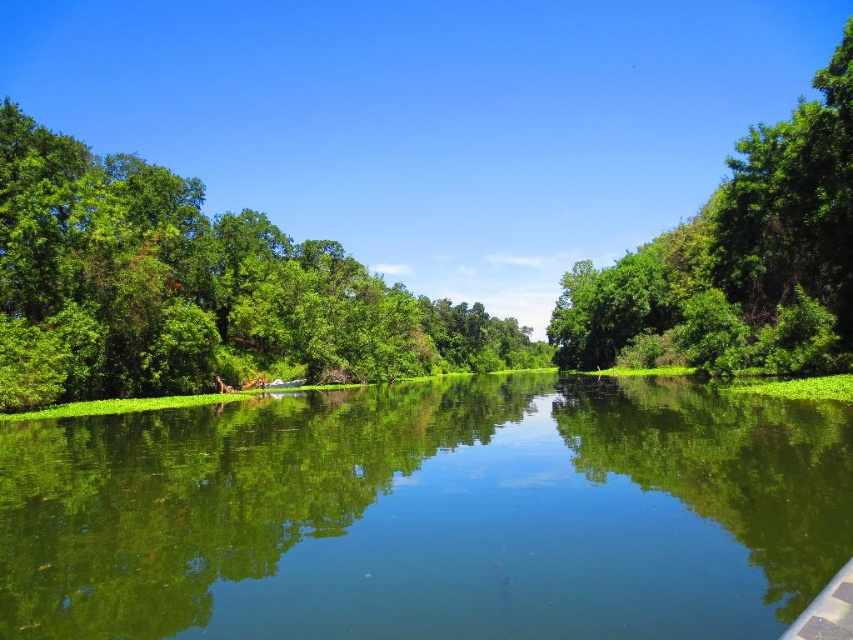
Who is higher up, green leafy tree at center or green leafy tree at right?

green leafy tree at right is higher up.

Can you confirm if green leafy tree at center is thinner than green leafy tree at right?

No.

Who is more distant from viewer, (281, 340) or (821, 268)?

Positioned behind is point (281, 340).

At what (x,y) coordinates should I click in order to perform the action: click on green leafy tree at center. Please return your answer as a coordinate pair (x, y). This screenshot has height=640, width=853. Looking at the image, I should click on click(x=195, y=291).

Does point (555, 410) come behind point (776, 179)?

No, (555, 410) is closer to viewer.

Which is behind, point (194, 580) or point (558, 344)?

Positioned behind is point (558, 344).

Where is `green reflective water at center`? This screenshot has height=640, width=853. green reflective water at center is located at coordinates (428, 515).

Which of these two, green reflective water at center or green leafy tree at center, stands taller?

With more height is green leafy tree at center.

Which is behind, point (682, 554) or point (248, 362)?

Point (248, 362)

Is point (805, 490) closer to camera compared to point (502, 348)?

Yes, point (805, 490) is in front of point (502, 348).

At what (x,y) coordinates should I click in order to perform the action: click on green reflective water at center. Please return your answer as a coordinate pair (x, y). The height and width of the screenshot is (640, 853). Looking at the image, I should click on (428, 515).